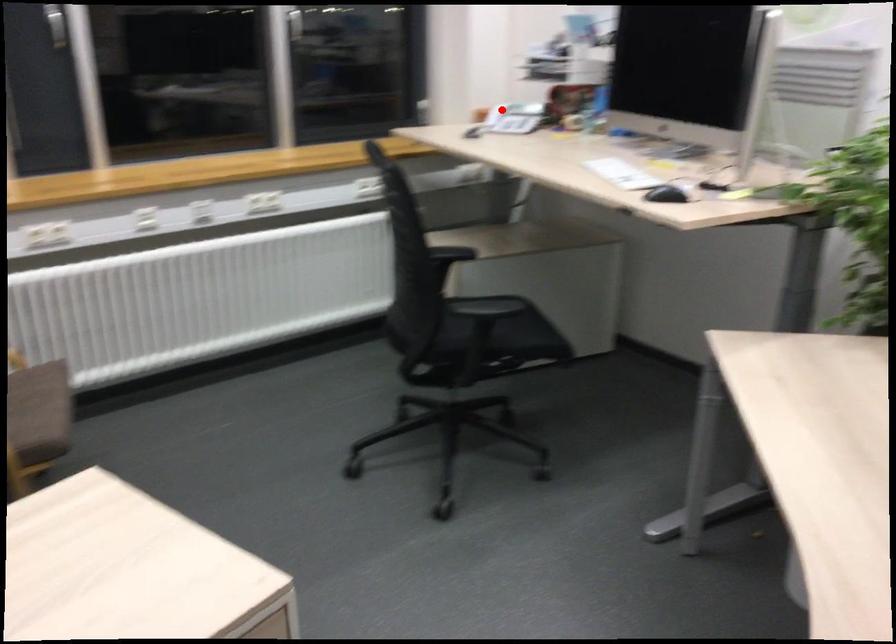
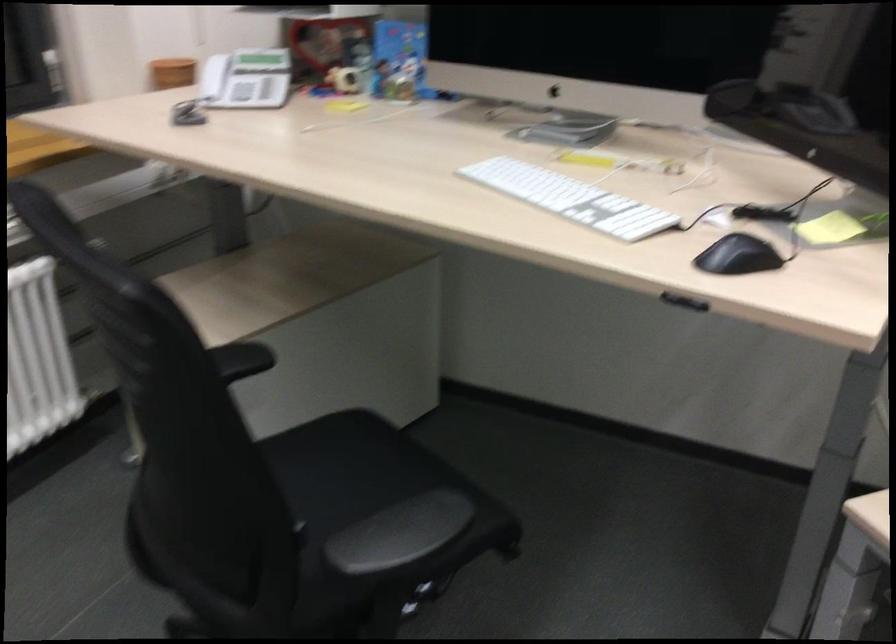
In the second image, find the point that corresponds to the highlighted location in the first image.

(212, 77)